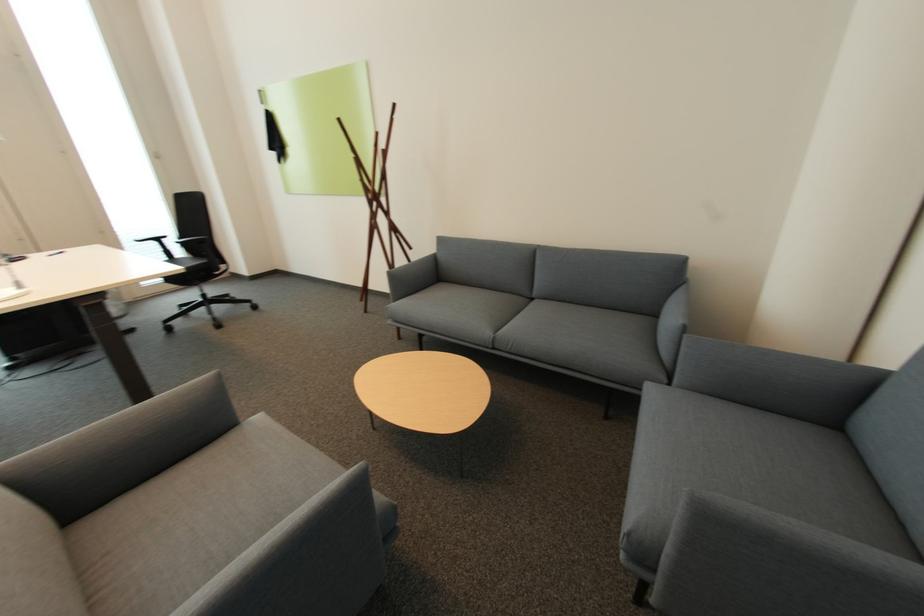
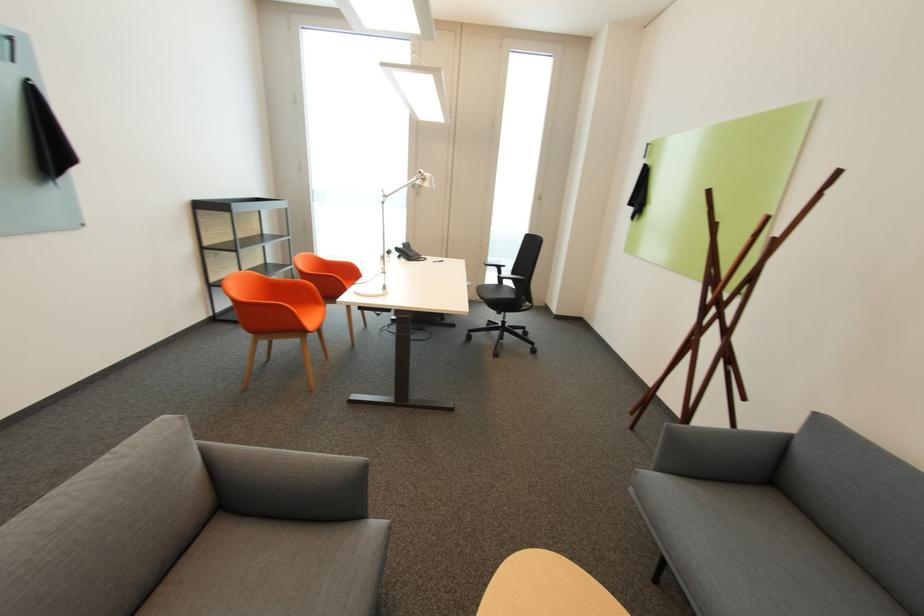
In the second image, find the point that corresponds to pixel 369 301 in the first image.

(638, 414)